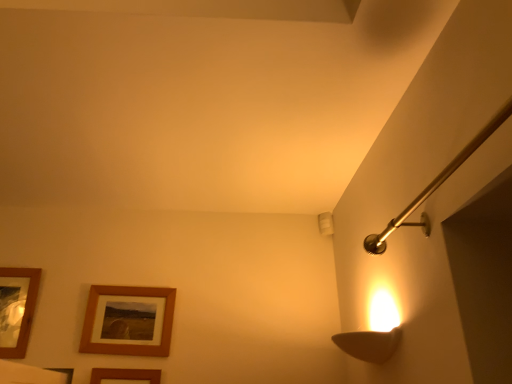
Question: Should I look upward or downward to see woodenobject at lower left, placed as the 2th picture frame when sorted from left to right?

Choices:
 (A) up
 (B) down

Answer: (B)

Question: Considering the relative positions of wooden framed picture at lower left, which ranks as the 3th picture frame in right-to-left order, and woodenobject at lower left, arranged as the second picture frame when viewed from the right, in the image provided, is wooden framed picture at lower left, which ranks as the 3th picture frame in right-to-left order, to the left of woodenobject at lower left, arranged as the second picture frame when viewed from the right, from the viewer's perspective?

Choices:
 (A) no
 (B) yes

Answer: (B)

Question: Is wooden framed picture at lower left, placed as the first picture frame when sorted from left to right, not within woodenobject at lower left, arranged as the second picture frame when viewed from the right?

Choices:
 (A) yes
 (B) no

Answer: (A)

Question: Does wooden framed picture at lower left, placed as the first picture frame when sorted from left to right, have a greater height compared to woodenobject at lower left, placed as the 2th picture frame when sorted from left to right?

Choices:
 (A) no
 (B) yes

Answer: (B)

Question: Is wooden framed picture at lower left, placed as the first picture frame when sorted from left to right, at the right side of woodenobject at lower left, placed as the 2th picture frame when sorted from left to right?

Choices:
 (A) no
 (B) yes

Answer: (A)

Question: Is wooden framed picture at lower left, placed as the first picture frame when sorted from left to right, bigger than woodenobject at lower left, placed as the 2th picture frame when sorted from left to right?

Choices:
 (A) yes
 (B) no

Answer: (A)

Question: Is wooden framed picture at lower left, which ranks as the 3th picture frame in right-to-left order, thinner than woodenobject at lower left, placed as the 2th picture frame when sorted from left to right?

Choices:
 (A) no
 (B) yes

Answer: (B)

Question: From the image's perspective, would you say brown wooden picture frame at lower left, marked as the third picture frame in a left-to-right arrangement, is positioned over wooden framed picture at lower left, which ranks as the 3th picture frame in right-to-left order?

Choices:
 (A) yes
 (B) no

Answer: (B)

Question: Is brown wooden picture frame at lower left, marked as the third picture frame in a left-to-right arrangement, positioned with its back to wooden framed picture at lower left, placed as the first picture frame when sorted from left to right?

Choices:
 (A) no
 (B) yes

Answer: (A)

Question: Does brown wooden picture frame at lower left, which appears as the first picture frame when viewed from the right, lie behind wooden framed picture at lower left, which ranks as the 3th picture frame in right-to-left order?

Choices:
 (A) no
 (B) yes

Answer: (A)

Question: Is brown wooden picture frame at lower left, marked as the third picture frame in a left-to-right arrangement, shorter than wooden framed picture at lower left, which ranks as the 3th picture frame in right-to-left order?

Choices:
 (A) no
 (B) yes

Answer: (A)

Question: Can you confirm if brown wooden picture frame at lower left, marked as the third picture frame in a left-to-right arrangement, is thinner than wooden framed picture at lower left, placed as the first picture frame when sorted from left to right?

Choices:
 (A) yes
 (B) no

Answer: (A)

Question: From a real-world perspective, is brown wooden picture frame at lower left, marked as the third picture frame in a left-to-right arrangement, positioned over wooden framed picture at lower left, placed as the first picture frame when sorted from left to right, based on gravity?

Choices:
 (A) yes
 (B) no

Answer: (B)

Question: Is brown wooden picture frame at lower left, which appears as the first picture frame when viewed from the right, outside woodenobject at lower left, placed as the 2th picture frame when sorted from left to right?

Choices:
 (A) yes
 (B) no

Answer: (A)